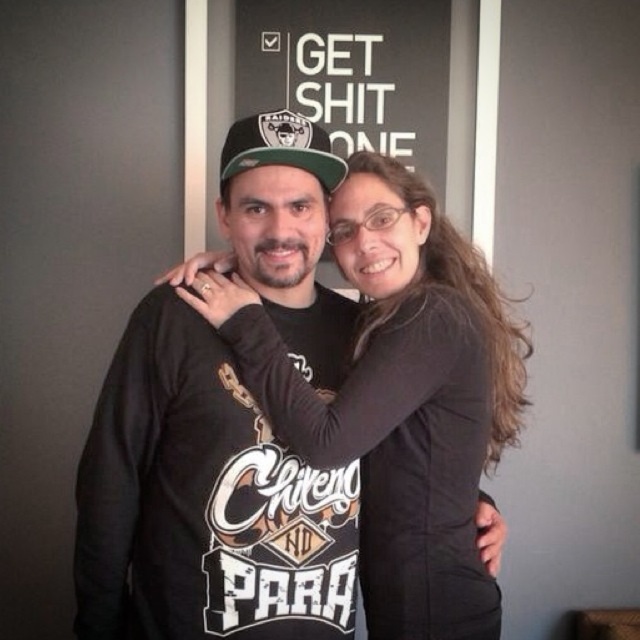
Question: Is black matte shirt at center below camo fabric baseball cap at center?

Choices:
 (A) no
 (B) yes

Answer: (B)

Question: Does black matte shirt at center appear on the left side of camo fabric baseball cap at center?

Choices:
 (A) no
 (B) yes

Answer: (A)

Question: Among these objects, which one is farthest from the camera?

Choices:
 (A) black matte shirt at center
 (B) camo fabric baseball cap at center

Answer: (B)

Question: Can you confirm if black matte shirt at center is positioned to the left of camo fabric baseball cap at center?

Choices:
 (A) yes
 (B) no

Answer: (B)